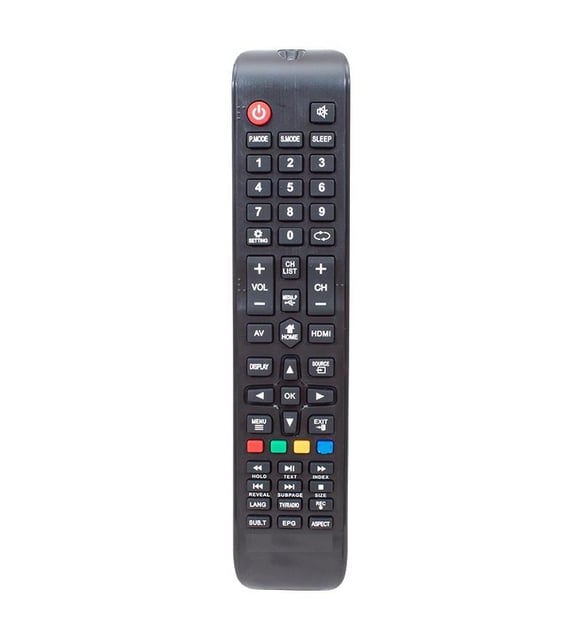
Locate an element on the screen. number buttons on remote control is located at coordinates (x=255, y=161), (x=282, y=163), (x=319, y=161), (x=322, y=180), (x=293, y=182), (x=258, y=187), (x=258, y=207), (x=286, y=210), (x=318, y=210), (x=293, y=232).